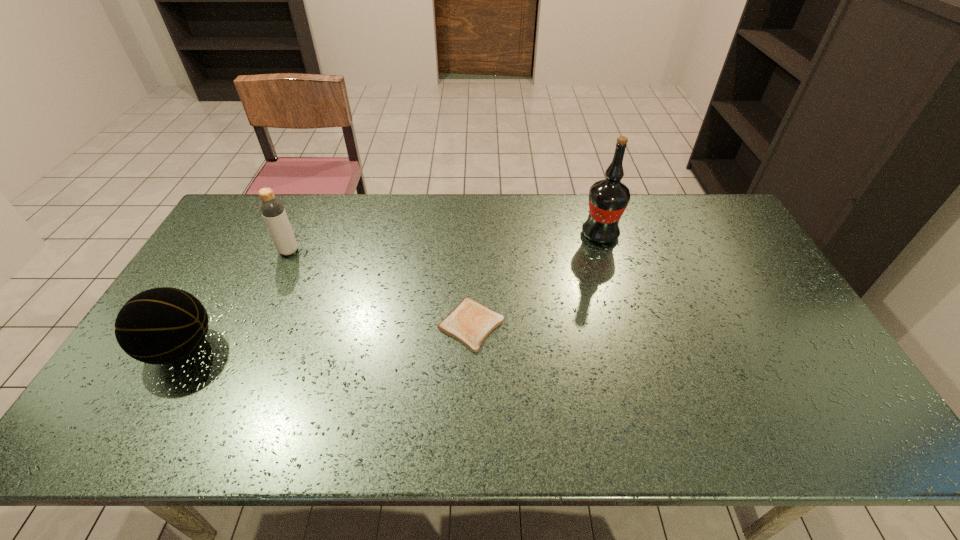
I want to click on the rightmost object, so click(608, 198).

Locate an element on the screen. the tallest object is located at coordinates (608, 198).

This screenshot has height=540, width=960. What are the coordinates of `bottle` in the screenshot? It's located at (272, 209).

Locate an element on the screen. the third shortest object is located at coordinates (272, 209).

Find the location of `basketball`. basketball is located at coordinates (163, 325).

At what (x,y) coordinates should I click in order to perform the action: click on the leftmost object. Please return your answer as a coordinate pair (x, y). Looking at the image, I should click on (163, 325).

Identify the location of toast. This screenshot has width=960, height=540. (470, 322).

This screenshot has height=540, width=960. I want to click on the shortest object, so click(470, 322).

Where is `free space located 0.140m on the left of the wine bottle`? The width and height of the screenshot is (960, 540). free space located 0.140m on the left of the wine bottle is located at coordinates (540, 234).

The height and width of the screenshot is (540, 960). Identify the location of vacant space located 0.380m on the right of the second tallest object. (416, 251).